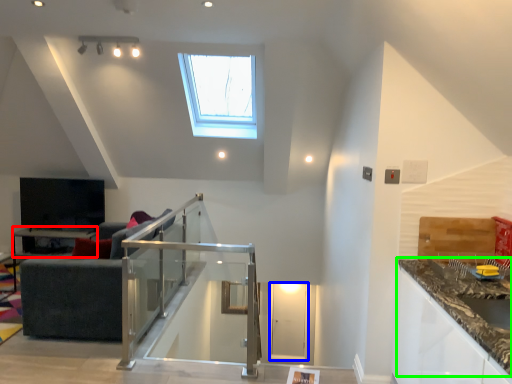
Question: Which is nearer to the table (highlighted by a red box)? glass door (highlighted by a blue box) or countertop (highlighted by a green box).

Choices:
 (A) glass door
 (B) countertop

Answer: (A)